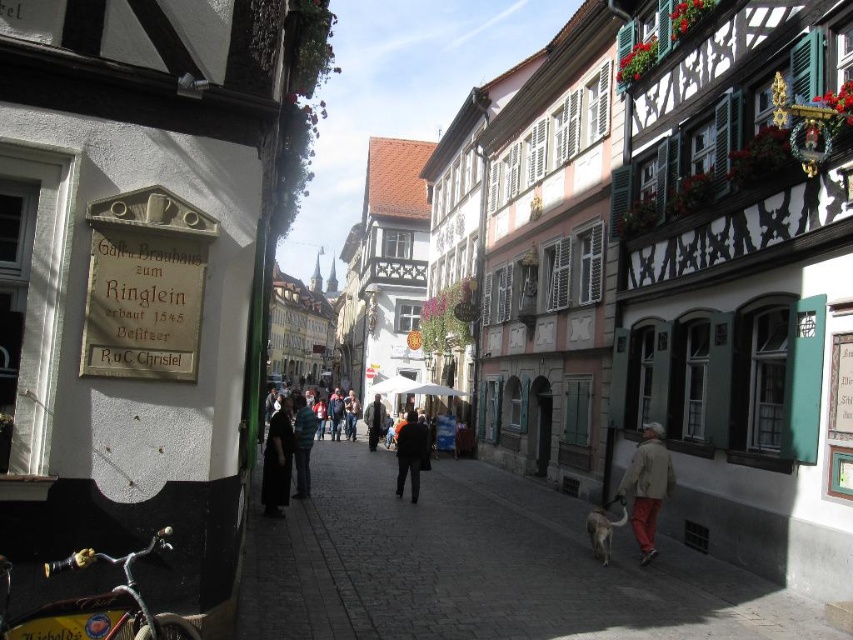
You are a tourist walking down this historic street and notice two jackets hanging on a rack at the center. The jackets are a dark blue jacket at center and a dark gray jacket at center. Which jacket is taller?

The dark blue jacket at center is much taller as the dark gray jacket at center.

You are a tourist standing on the street and see the dark fabric coat at center and the green striped shirt at center. Which clothing item is taller?

The dark fabric coat at center is taller than the green striped shirt at center.

You are standing on the street in front of the historic buildings and notice two points marked on the ground. The first point is at coordinates point (x=270, y=429) and the second is at point (x=305, y=435). Which point is closer to you?

Point (x=270, y=429) is in front of point (x=305, y=435), so it is closer to you.